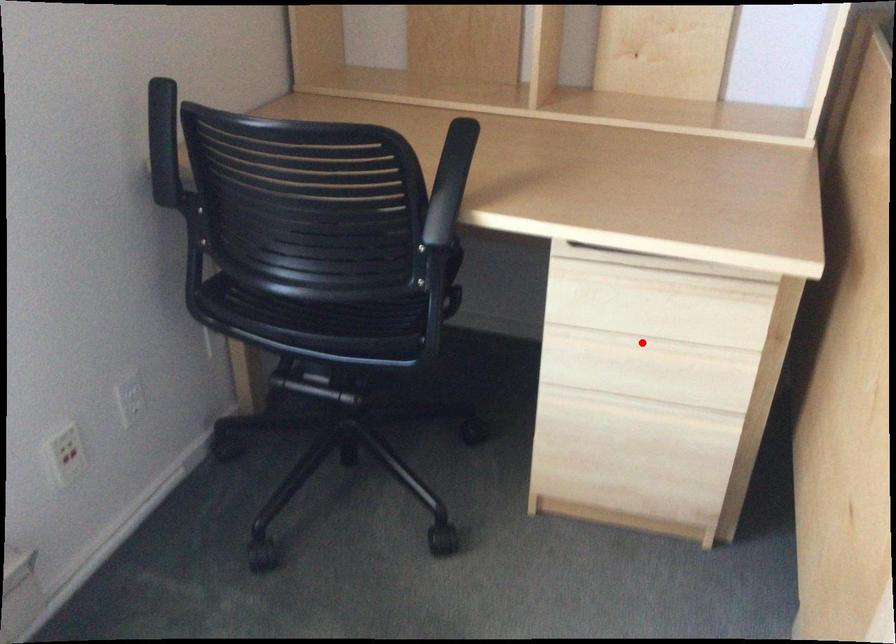
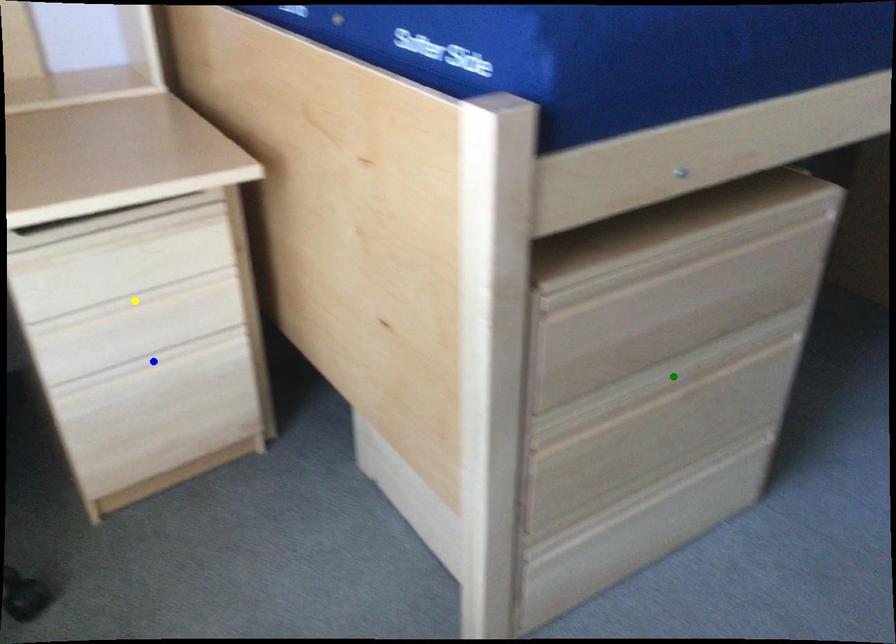
Question: I am providing you with two images of the same scene from different viewpoints. A red point is marked on the first image. You are given multiple points on the second image. Which point in image 2 is actually the same real-world point as the red point in image 1?

Choices:
 (A) green point
 (B) yellow point
 (C) blue point

Answer: (B)